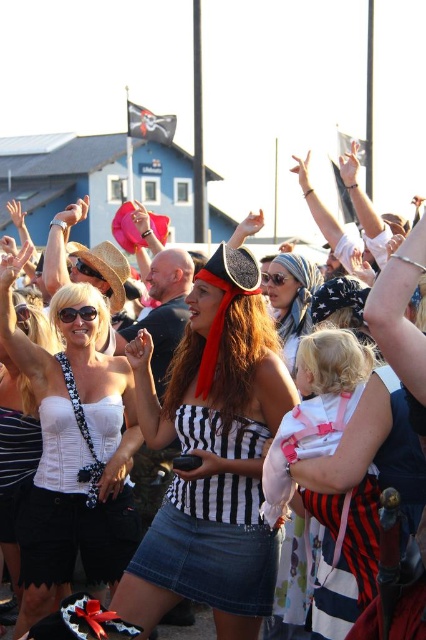
Does striped fabric top at center come in front of black matte goggles at center?

Yes.

Is striped fabric top at center thinner than black matte goggles at center?

Incorrect, striped fabric top at center's width is not less than black matte goggles at center's.

Between point (229, 371) and point (275, 273), which one is positioned in front?

Point (229, 371)

Find the location of a particular element. This screenshot has height=640, width=426. striped fabric top at center is located at coordinates (212, 456).

Does white matte corset at center have a greater width compared to striped fabric skirt at center?

Yes, white matte corset at center is wider than striped fabric skirt at center.

Who is more forward, (66, 467) or (229, 492)?

Point (229, 492)

The height and width of the screenshot is (640, 426). Describe the element at coordinates (72, 449) in the screenshot. I see `white matte corset at center` at that location.

You are a GUI agent. You are given a task and a screenshot of the screen. Output one action in this format:
    pyautogui.click(x=<x>, y=<y>)
    Task: Click on the white matte corset at center
    The image size is (426, 640).
    Given the screenshot: What is the action you would take?
    pyautogui.click(x=72, y=449)

Does white matte corset at center have a greater width compared to black matte goggles at center?

Yes, white matte corset at center is wider than black matte goggles at center.

Does point (11, 291) come in front of point (285, 273)?

That is True.

Find the location of a particular element. white matte corset at center is located at coordinates (72, 449).